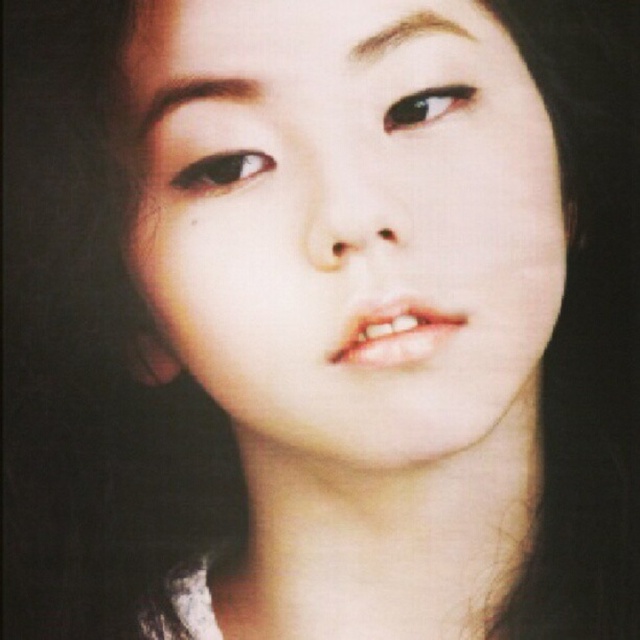
You are an artist analyzing this portrait. You notice two points of interest in the image at coordinates point (342, 426) and point (388, 124). Based on their positions, which point is closer to the viewer?

Point (388, 124) is closer to the viewer because it is in front of point (342, 426) according to their spatial arrangement.

What are the coordinates of the smooth skin face at center in the image?

The smooth skin face at center is located at coordinates point (346, 220).

You are a photographer adjusting lighting for a portrait. You notice the smooth skin face at center and the brown matte eye at center in your viewfinder. Which object is closer to the camera?

The smooth skin face at center is closer to the camera than the brown matte eye at center because it is positioned in front of it.